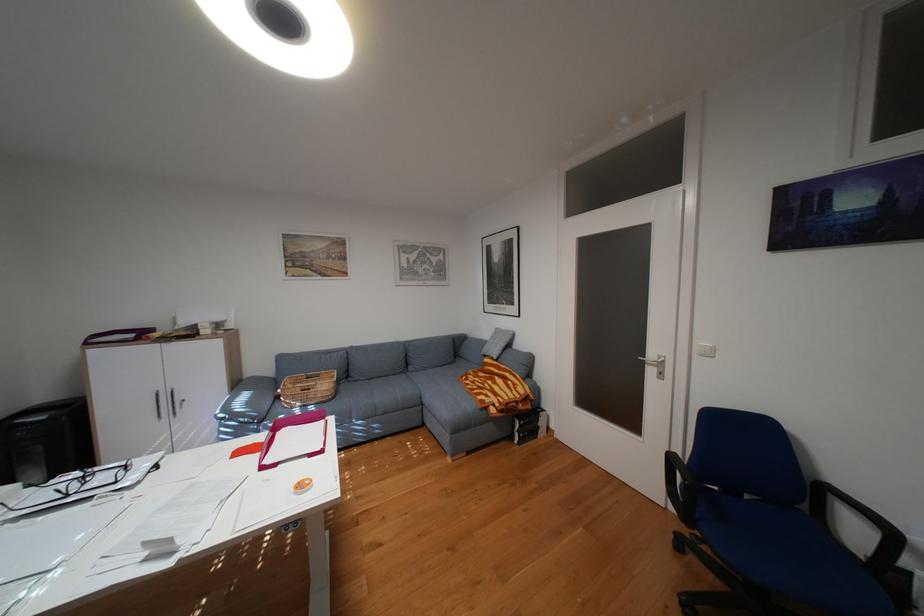
Describe the element at coordinates (781, 531) in the screenshot. The image size is (924, 616). I see `the blue chair surface` at that location.